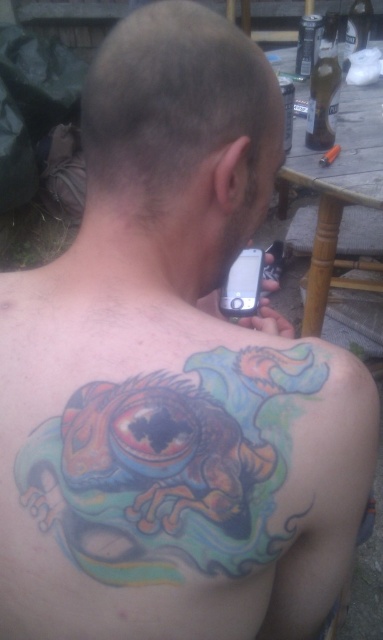
You are a photographer trying to capture the tattoo and hair of the person in the image. Since you want to ensure both are visible, can you determine if the colorful tattoo at upper back is taller than the shiny hair at upper center?

The colorful tattoo at upper back is not as tall as shiny hair at upper center, so the tattoo is shorter than the hair. Therefore, the shiny hair at upper center is taller, and both will be visible in the photo.

You are a photographer trying to capture the colorful tattoo at upper back and the shiny hair at upper center in a single shot. Based on their positions, do you think the tattoo will appear wider than the hair in the photo?

The colorful tattoo at upper back might be wider than shiny hair at upper center, so yes, the tattoo could appear wider in the photo.

You are a photographer taking a portrait of the person from behind. You want to ensure both the colorful tattoo at upper back and the shiny hair at upper center are clearly visible in the photo. Based on their positions, is there a risk that one might cover part of the other?

The colorful tattoo at upper back is in front of the shiny hair at upper center, so the tattoo may partially obscure the hair, creating a risk that part of the shiny hair at upper center is covered.